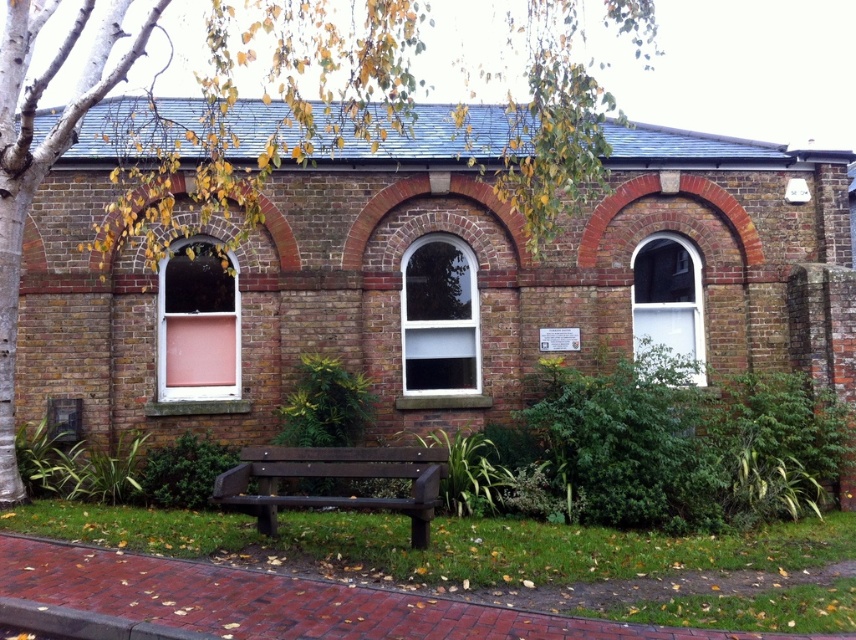
You are standing in front of the brick building and want to know the relative positions of the pink glass window at left and the white glass window at upper right. Which one is higher up?

The white glass window at upper right is higher up because the pink glass window at left is below it.

Looking at this image, you are standing in front of the brick building and want to take a photo of both the pink glass window at left and the white glass window at center. Which window should you focus on first to ensure both are in the frame?

You should focus on the pink glass window at left first because it is closer to the viewer than the white glass window at center, ensuring both are in the frame.